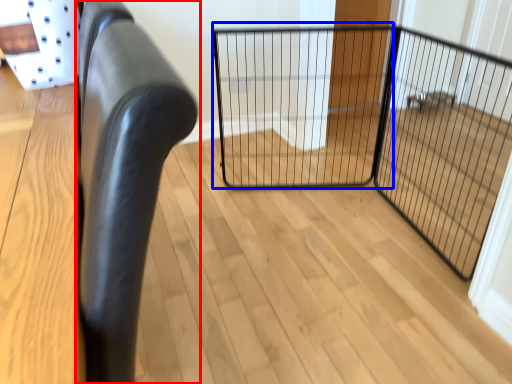
Question: Which object is further to the camera taking this photo, furniture (highlighted by a red box) or cage (highlighted by a blue box)?

Choices:
 (A) furniture
 (B) cage

Answer: (B)